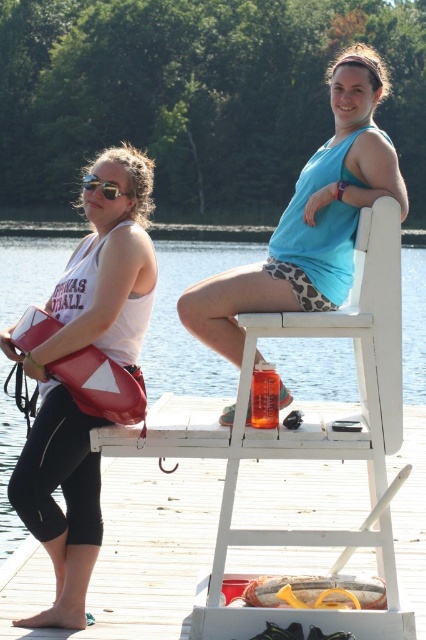
Question: Which object is farther from the camera taking this photo?

Choices:
 (A) matte white tank top at left
 (B) transparent plastic water at center
 (C) matte black sunglasses at left
 (D) white wood dock at center

Answer: (C)

Question: Which point is closer to the camera?

Choices:
 (A) (132, 180)
 (B) (112, 513)
 (C) (103, 180)
 (D) (420, 400)

Answer: (C)

Question: Where is matte white tank top at left located in relation to blue fabric tank top at center in the image?

Choices:
 (A) below
 (B) above

Answer: (A)

Question: Which of the following is the closest to the observer?

Choices:
 (A) (98, 186)
 (B) (382, 150)
 (C) (13, 417)
 (D) (321, 472)

Answer: (B)

Question: Is the position of matte white tank top at left more distant than that of blue fabric tank top at center?

Choices:
 (A) yes
 (B) no

Answer: (A)

Question: Is white wood dock at center above matte black sunglasses at left?

Choices:
 (A) no
 (B) yes

Answer: (A)